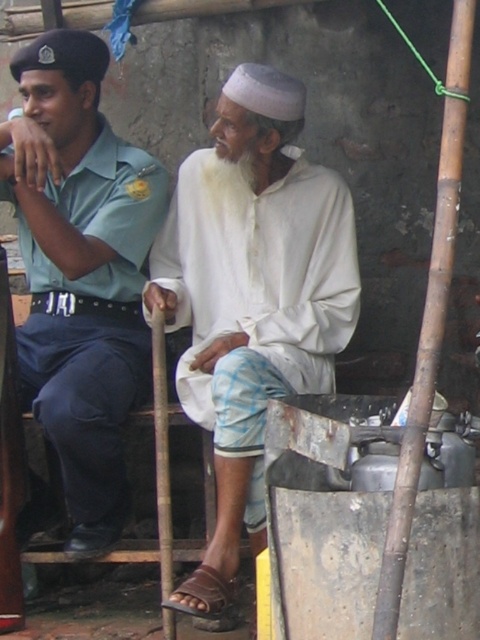
Question: Is green uniform at left to the left of brown leather sandal at lower center from the viewer's perspective?

Choices:
 (A) yes
 (B) no

Answer: (A)

Question: Which point is closer to the camera?

Choices:
 (A) white matte cloth at center
 (B) brown leather sandal at lower center

Answer: (B)

Question: Among these points, which one is farthest from the camera?

Choices:
 (A) (211, 266)
 (B) (213, 602)

Answer: (A)

Question: Is the position of green uniform at left more distant than that of brown leather sandal at lower center?

Choices:
 (A) yes
 (B) no

Answer: (A)

Question: Is white matte cloth at center behind green uniform at left?

Choices:
 (A) yes
 (B) no

Answer: (B)

Question: Which point is farther to the camera?

Choices:
 (A) green uniform at left
 (B) brown leather sandal at lower center
 (C) white matte cloth at center

Answer: (A)